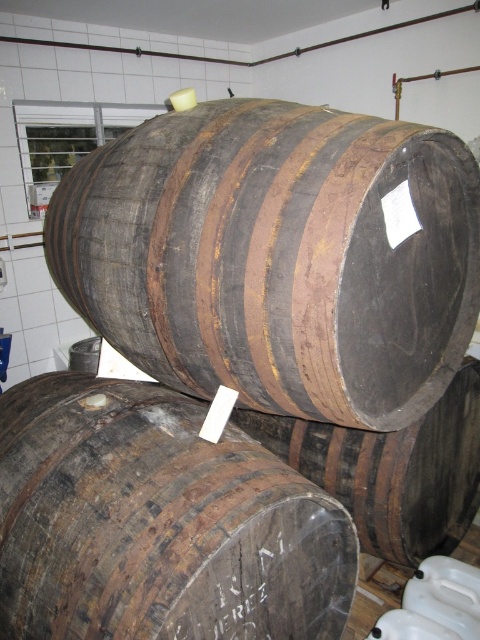
Is dark brown wooden barrel at center in front of dark brown wood barrel at center?

Yes, it is.

Which is behind, point (454, 177) or point (432, 440)?

Point (432, 440)

Where is `dark brown wooden barrel at center`? This screenshot has width=480, height=640. dark brown wooden barrel at center is located at coordinates (277, 257).

Where is `dark brown wooden barrel at center`? The image size is (480, 640). dark brown wooden barrel at center is located at coordinates (277, 257).

Can you confirm if dark brown wooden barrel at center is positioned above rusty wood barrel at center?

Indeed, dark brown wooden barrel at center is positioned over rusty wood barrel at center.

What do you see at coordinates (277, 257) in the screenshot? This screenshot has width=480, height=640. I see `dark brown wooden barrel at center` at bounding box center [277, 257].

At what (x,y) coordinates should I click in order to perform the action: click on dark brown wooden barrel at center. Please return your answer as a coordinate pair (x, y). Looking at the image, I should click on (277, 257).

From the picture: Between rusty wood barrel at center and dark brown wood barrel at center, which one has less height?

With less height is rusty wood barrel at center.

Who is more forward, (104, 589) or (399, 560)?

Point (104, 589) is in front.

At what (x,y) coordinates should I click in order to perform the action: click on rusty wood barrel at center. Please return your answer as a coordinate pair (x, y). The width and height of the screenshot is (480, 640). Looking at the image, I should click on (157, 522).